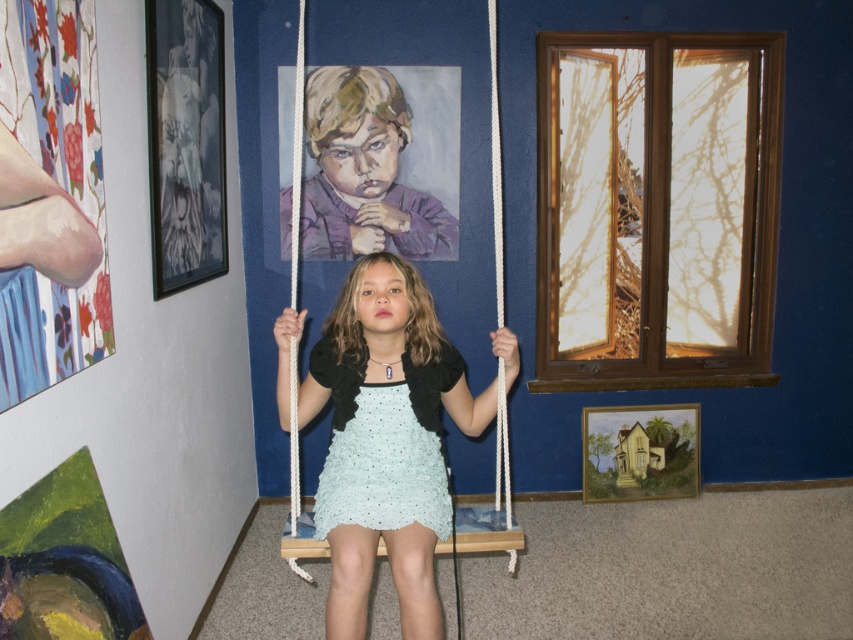
Which is above, light blue fabric dress at center or light blue crocheted dress at center?

light blue crocheted dress at center

Where is `light blue fabric dress at center`? light blue fabric dress at center is located at coordinates (387, 419).

Between point (418, 540) and point (343, 424), which one is positioned in front?

Point (418, 540) is more forward.

You are a GUI agent. You are given a task and a screenshot of the screen. Output one action in this format:
    pyautogui.click(x=<x>, y=<y>)
    Task: Click on the light blue fabric dress at center
    
    Given the screenshot: What is the action you would take?
    pyautogui.click(x=387, y=419)